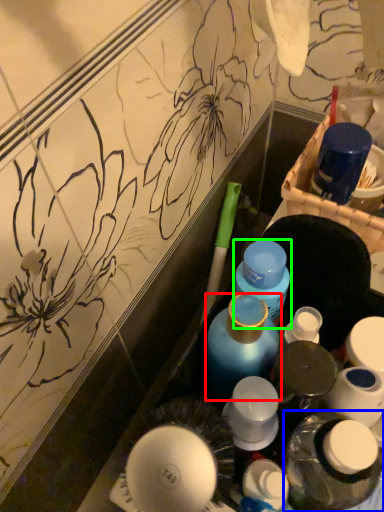
Question: Which is farther away from bottle (highlighted by a red box)? bottle (highlighted by a blue box) or bottle (highlighted by a green box)?

Choices:
 (A) bottle
 (B) bottle

Answer: (A)